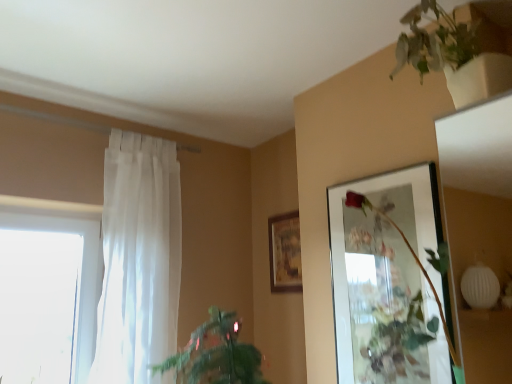
Question: Based on their positions, is white sheer curtain at left located to the left or right of matte glass picture frame at upper right, the 2th picture frame viewed from the left?

Choices:
 (A) left
 (B) right

Answer: (A)

Question: Considering the positions of point (129, 329) and point (360, 178), is point (129, 329) closer or farther from the camera than point (360, 178)?

Choices:
 (A) closer
 (B) farther

Answer: (B)

Question: Considering the real-world distances, which object is closest to the wooden framed artwork at center, which is counted as the 2th picture frame, starting from the front?

Choices:
 (A) white sheer curtain at left
 (B) green leafy plant at lower left, which is the 1th houseplant from left to right
 (C) green matte plant at upper right, which is counted as the first houseplant, starting from the right
 (D) matte glass picture frame at upper right, the 2th picture frame viewed from the left

Answer: (B)

Question: Which object is the farthest from the matte glass picture frame at upper right, the 2th picture frame viewed from the left?

Choices:
 (A) white sheer curtain at left
 (B) wooden framed artwork at center, which is counted as the first picture frame, starting from the back
 (C) green leafy plant at lower left, marked as the second houseplant in a top-to-bottom arrangement
 (D) green matte plant at upper right, arranged as the second houseplant when ordered from the bottom

Answer: (A)